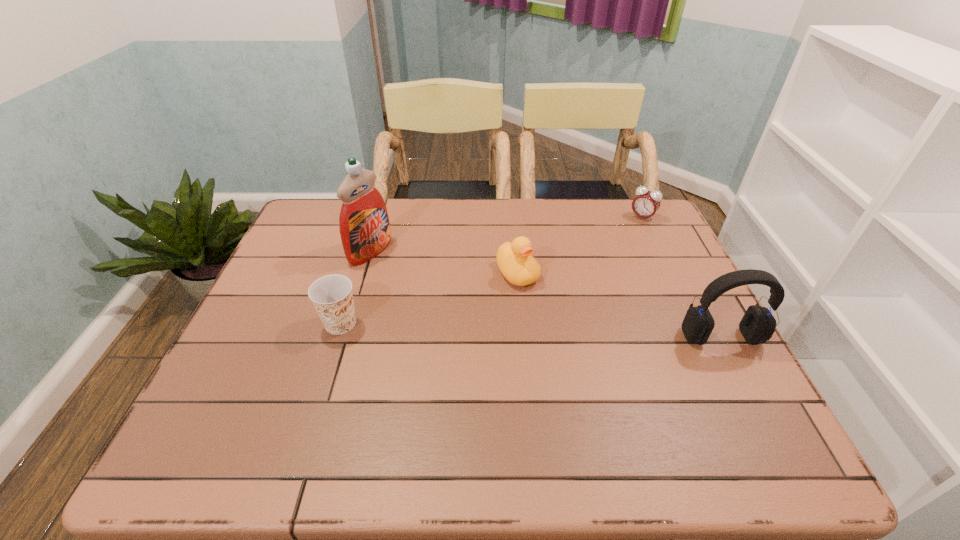
At what (x,y) coordinates should I click in order to perform the action: click on object present at the far right corner. Please return your answer as a coordinate pair (x, y). Looking at the image, I should click on (646, 203).

In the image, there is a desktop. Identify the location of free space at the far edge. (607, 223).

In order to click on free space at the near edge of the desktop in this screenshot , I will do `click(592, 405)`.

Identify the location of free space at the left edge. Image resolution: width=960 pixels, height=540 pixels. (249, 314).

Locate an element on the screen. The height and width of the screenshot is (540, 960). free space at the right edge is located at coordinates (658, 296).

Find the location of a particular element. This screenshot has height=540, width=960. free region at the far left corner is located at coordinates (322, 240).

Image resolution: width=960 pixels, height=540 pixels. Find the location of `vacant area at the near left corner of the desktop`. vacant area at the near left corner of the desktop is located at coordinates (233, 412).

This screenshot has height=540, width=960. What are the coordinates of `empty location between the Dixie cup and the tallest object` in the screenshot? It's located at (x=355, y=287).

Where is `free spot between the alarm clock and the headset`? free spot between the alarm clock and the headset is located at coordinates (682, 277).

Identify the location of free point between the farthest object and the third object from left to right. (580, 245).